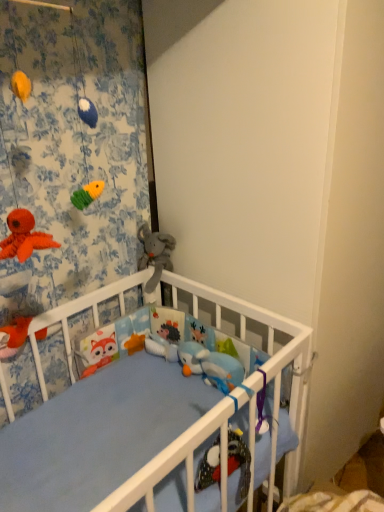
Question: From the image's perspective, is matte orange plush toy at lower left, which appears as the second toy when viewed from the right, below soft gray plush elephant at center, which is counted as the 2th toy, starting from the left?

Choices:
 (A) no
 (B) yes

Answer: (B)

Question: Is matte orange plush toy at lower left, which is the first toy in bottom-to-top order, in front of soft gray plush elephant at center, which appears as the 1th toy when viewed from the right?

Choices:
 (A) yes
 (B) no

Answer: (A)

Question: Does matte orange plush toy at lower left, the first toy from the front, have a lesser height compared to soft gray plush elephant at center, the second toy in the front-to-back sequence?

Choices:
 (A) yes
 (B) no

Answer: (A)

Question: Would you say matte orange plush toy at lower left, which is counted as the 2th toy, starting from the back, contains soft gray plush elephant at center, the second toy in the front-to-back sequence?

Choices:
 (A) yes
 (B) no

Answer: (B)

Question: Is matte orange plush toy at lower left, the first toy from the front, beside soft gray plush elephant at center, the first toy when ordered from back to front?

Choices:
 (A) yes
 (B) no

Answer: (B)

Question: Considering the relative positions of matte orange plush toy at lower left, which is the first toy in bottom-to-top order, and soft gray plush elephant at center, which ranks as the second toy in bottom-to-top order, in the image provided, is matte orange plush toy at lower left, which is the first toy in bottom-to-top order, to the right of soft gray plush elephant at center, which ranks as the second toy in bottom-to-top order, from the viewer's perspective?

Choices:
 (A) no
 (B) yes

Answer: (A)

Question: Does soft gray plush elephant at center, the first toy when ordered from back to front, have a greater height compared to floral fabric curtain at upper left?

Choices:
 (A) yes
 (B) no

Answer: (B)

Question: Is floral fabric curtain at upper left at the back of soft gray plush elephant at center, which ranks as the second toy in bottom-to-top order?

Choices:
 (A) yes
 (B) no

Answer: (B)

Question: Can you confirm if soft gray plush elephant at center, which is counted as the 2th toy, starting from the left, is smaller than floral fabric curtain at upper left?

Choices:
 (A) yes
 (B) no

Answer: (A)

Question: Does soft gray plush elephant at center, which ranks as the second toy in bottom-to-top order, appear on the left side of floral fabric curtain at upper left?

Choices:
 (A) no
 (B) yes

Answer: (A)

Question: Does soft gray plush elephant at center, which ranks as the second toy in bottom-to-top order, come in front of floral fabric curtain at upper left?

Choices:
 (A) yes
 (B) no

Answer: (B)

Question: Is soft gray plush elephant at center, which ranks as the second toy in bottom-to-top order, to the right of floral fabric curtain at upper left from the viewer's perspective?

Choices:
 (A) yes
 (B) no

Answer: (A)

Question: Does floral fabric curtain at upper left appear on the right side of soft gray plush elephant at center, which is counted as the 2th toy, starting from the left?

Choices:
 (A) yes
 (B) no

Answer: (B)